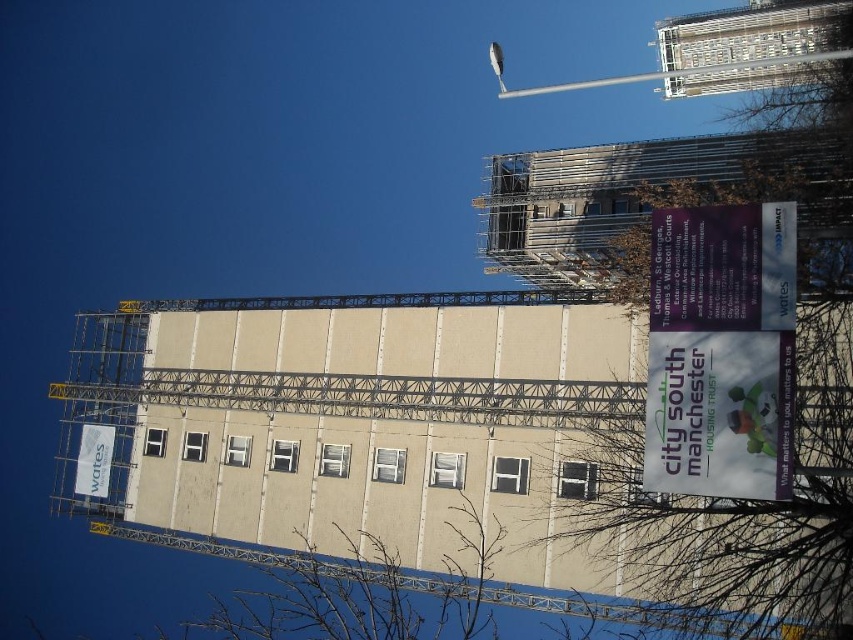
Question: Which object appears farthest from the camera in this image?

Choices:
 (A) beige concrete building at upper right
 (B) white paper sign at upper left
 (C) metallic pole at upper center
 (D) purple paper sign at upper right

Answer: (B)

Question: Considering the relative positions of metallic pole at upper center and white paper sign at upper left in the image provided, where is metallic pole at upper center located with respect to white paper sign at upper left?

Choices:
 (A) right
 (B) left

Answer: (A)

Question: Where is purple paper sign at upper right located in relation to white paper sign at upper left in the image?

Choices:
 (A) above
 (B) below

Answer: (A)

Question: Which point appears farthest from the camera in this image?

Choices:
 (A) coord(776,10)
 (B) coord(622,76)
 (C) coord(729,221)
 (D) coord(105,444)

Answer: (B)

Question: Which object appears farthest from the camera in this image?

Choices:
 (A) white paper sign at upper left
 (B) metallic pole at upper center
 (C) purple paper sign at upper right
 (D) beige concrete building at upper right

Answer: (A)

Question: Can you confirm if purple paper sign at upper right is bigger than metallic pole at upper center?

Choices:
 (A) no
 (B) yes

Answer: (A)